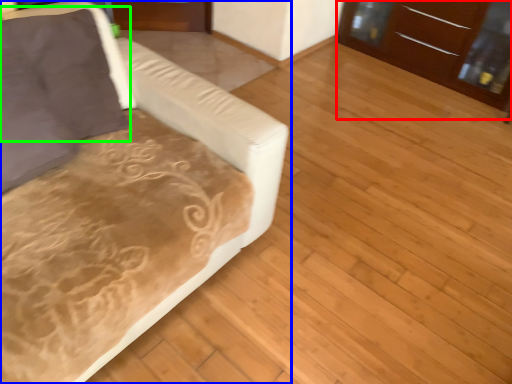
Question: Which object is positioned farthest from dresser (highlighted by a red box)? Select from studio couch (highlighted by a blue box) and pillow (highlighted by a green box).

Choices:
 (A) studio couch
 (B) pillow

Answer: (B)